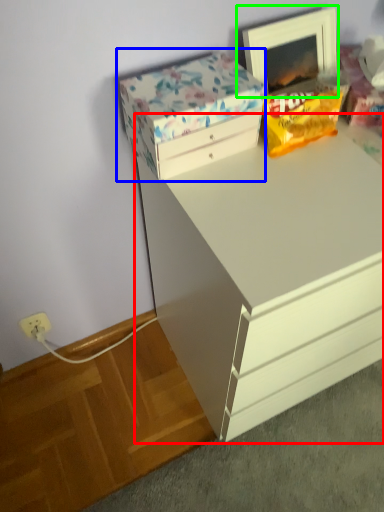
Question: Considering the real-world distances, which object is farthest from chest of drawers (highlighted by a red box)? storage box (highlighted by a blue box) or picture frame (highlighted by a green box)?

Choices:
 (A) storage box
 (B) picture frame

Answer: (B)